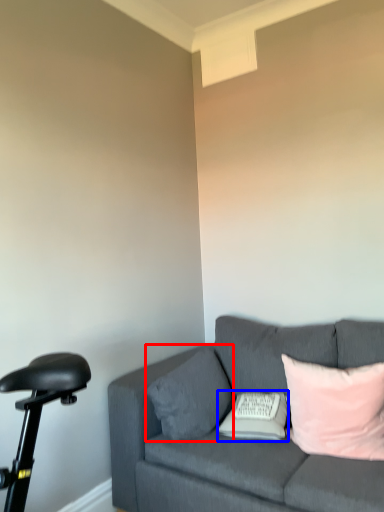
Question: Among these objects, which one is nearest to the camera, pillow (highlighted by a red box) or pillow (highlighted by a blue box)?

Choices:
 (A) pillow
 (B) pillow

Answer: (B)